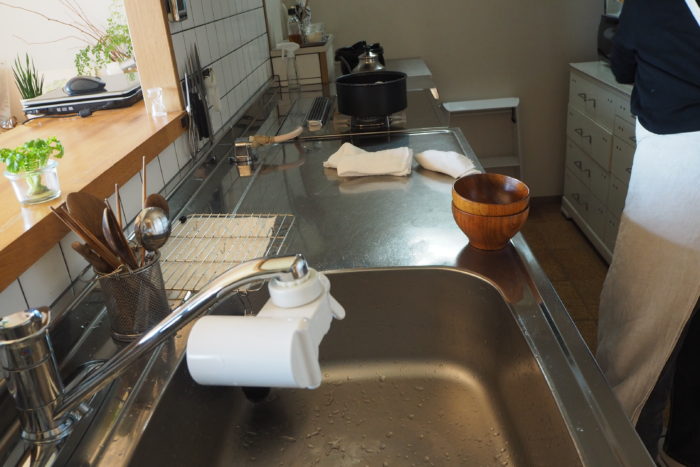
Where is `faucet`? faucet is located at coordinates (134, 341).